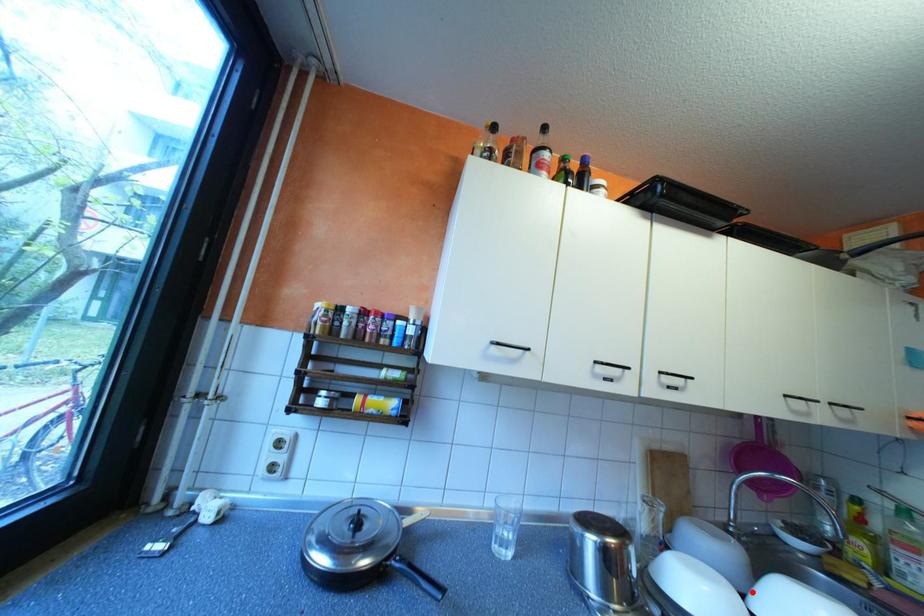
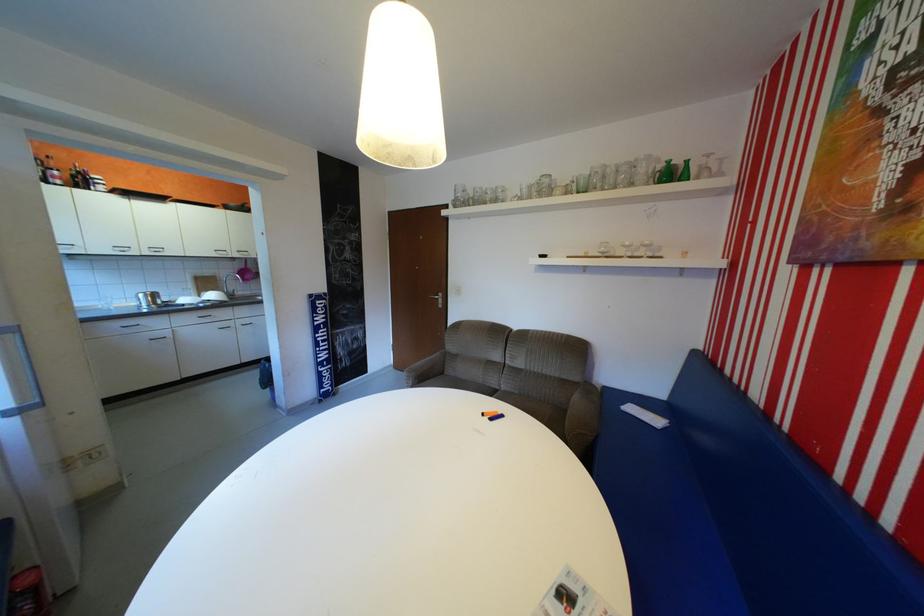
Find the pixel in the second image that matches the highlighted location in the first image.

(215, 298)